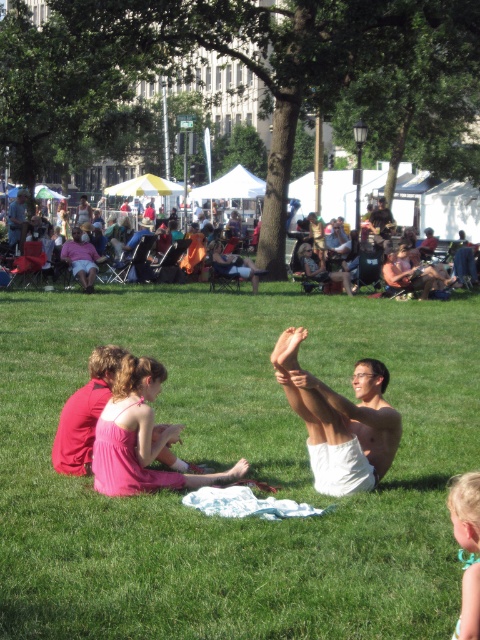
Question: Which point is farther to the camera?

Choices:
 (A) blonde hair at lower right
 (B) matte pink dress at center

Answer: (B)

Question: Which point appears farthest from the camera in this image?

Choices:
 (A) (436, 417)
 (B) (475, 480)
 (C) (442, 182)

Answer: (C)

Question: From the image, what is the correct spatial relationship of matte orange tent at center in relation to matte pink dress at center?

Choices:
 (A) above
 (B) below

Answer: (A)

Question: Is green grass at center to the left of pink satin dress at lower left from the viewer's perspective?

Choices:
 (A) no
 (B) yes

Answer: (A)

Question: Can you confirm if white cotton shorts at center is bigger than matte black laptop at upper left?

Choices:
 (A) no
 (B) yes

Answer: (A)

Question: Which of the following is the farthest from the observer?

Choices:
 (A) (75, 250)
 (B) (327, 442)
 (C) (395, 237)
 (D) (476, 490)

Answer: (C)